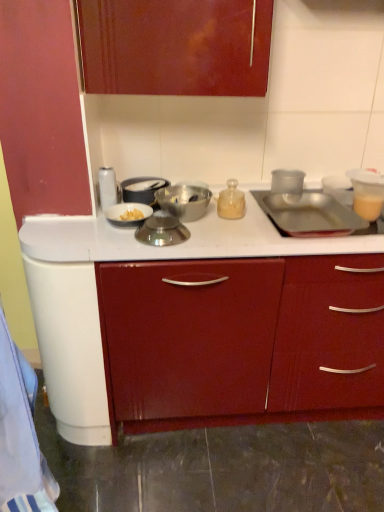
Locate an element on the screen. Image resolution: width=384 pixels, height=512 pixels. vacant area that is in front of white glossy bowl at center left, the 6th kitchen appliance positioned from the right is located at coordinates (122, 243).